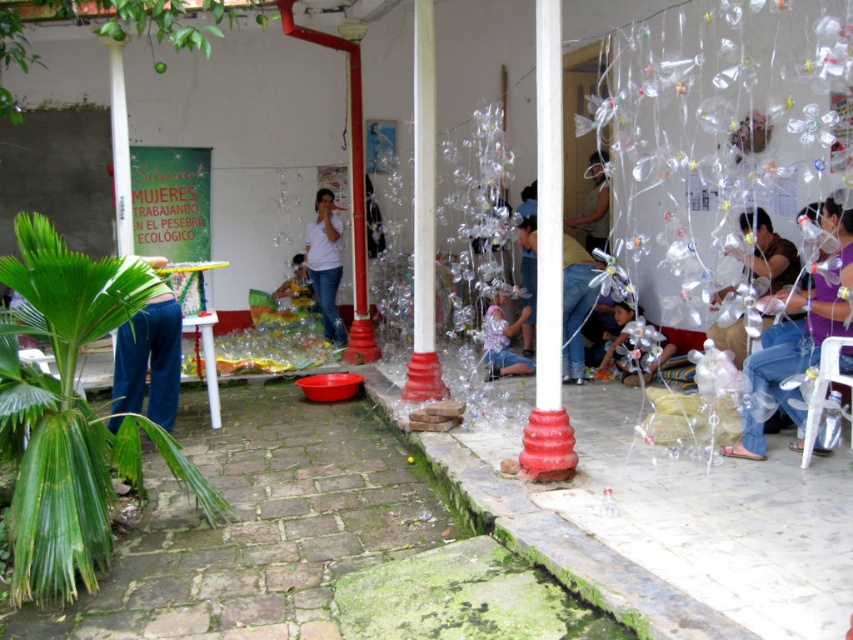
Question: Is metallic silver bracelet at lower right smaller than blue jeans at left?

Choices:
 (A) no
 (B) yes

Answer: (B)

Question: Among these points, which one is nearest to the camera?

Choices:
 (A) 766,253
 (B) 329,214
 (C) 518,236
 (D) 508,332

Answer: (A)

Question: Which object appears farthest from the camera in this image?

Choices:
 (A) matte brown fabric at center right
 (B) denim jeans at center
 (C) metallic silver pinwheel at center
 (D) blue jeans at left

Answer: (C)

Question: Which object is the closest to the metallic silver pinwheel at center?

Choices:
 (A) yellow fabric at center
 (B) matte brown fabric at center right
 (C) blue jeans at left
 (D) matte white shirt at center

Answer: (D)

Question: Does white matte shirt at center lie behind matte white shirt at center?

Choices:
 (A) no
 (B) yes

Answer: (B)

Question: Can you confirm if blue jeans at left is smaller than matte white shirt at center?

Choices:
 (A) yes
 (B) no

Answer: (B)